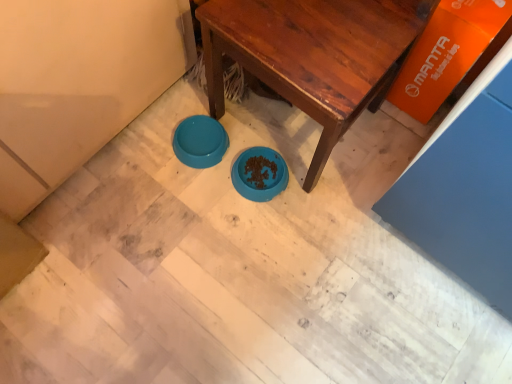
At what (x,y) coordinates should I click in order to perform the action: click on unoccupied area behind teal plastic bowl at center. Please return your answer as a coordinate pair (x, y). Image resolution: width=512 pixels, height=384 pixels. Looking at the image, I should click on (207, 100).